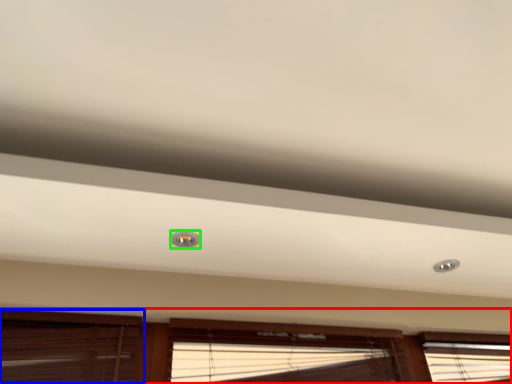
Question: Which object is the closest to the window (highlighted by a red box)? Choose among these: window (highlighted by a blue box) or droplight (highlighted by a green box).

Choices:
 (A) window
 (B) droplight

Answer: (A)